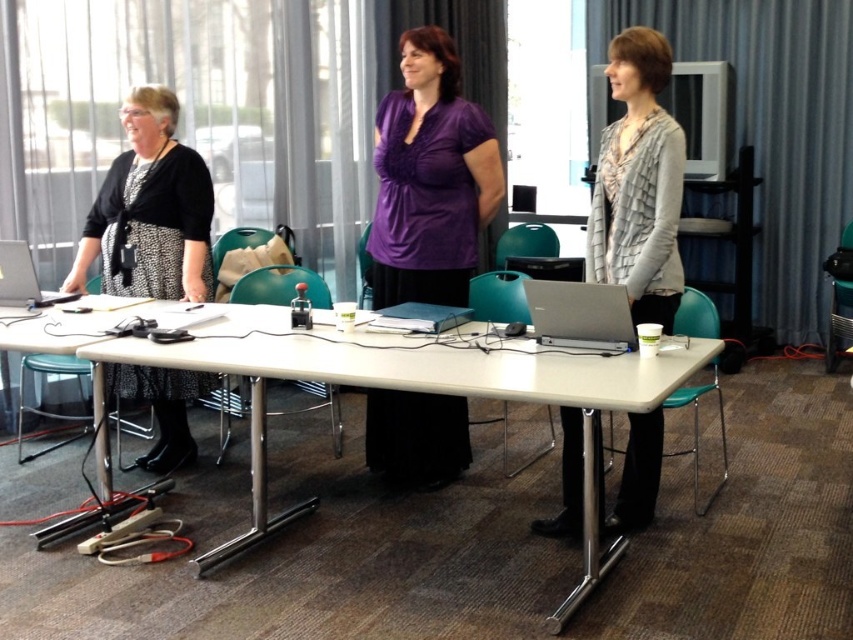
You are standing in the conference room and need to locate the point at coordinates (149, 209). Based on the scene description, where exactly is this point located?

The point at coordinates (149, 209) is located on the black dotted dress at left.

Based on the photo, you are organizing a conference and need to place a new item on the table. The gray textured sweater at center and the silver metallic laptop at center are already there. Which object takes up more space on the table?

The gray textured sweater at center takes up more space on the table because it is larger in size than the silver metallic laptop at center.

You are organizing a conference and need to place a name tag on the table between the gray textured sweater at center and the silver metallic laptop at center. Based on their positions, which object should the name tag be closer to?

The gray textured sweater at center is positioned on the right side of the silver metallic laptop at center, so the name tag should be placed closer to the silver metallic laptop at center to be between them.